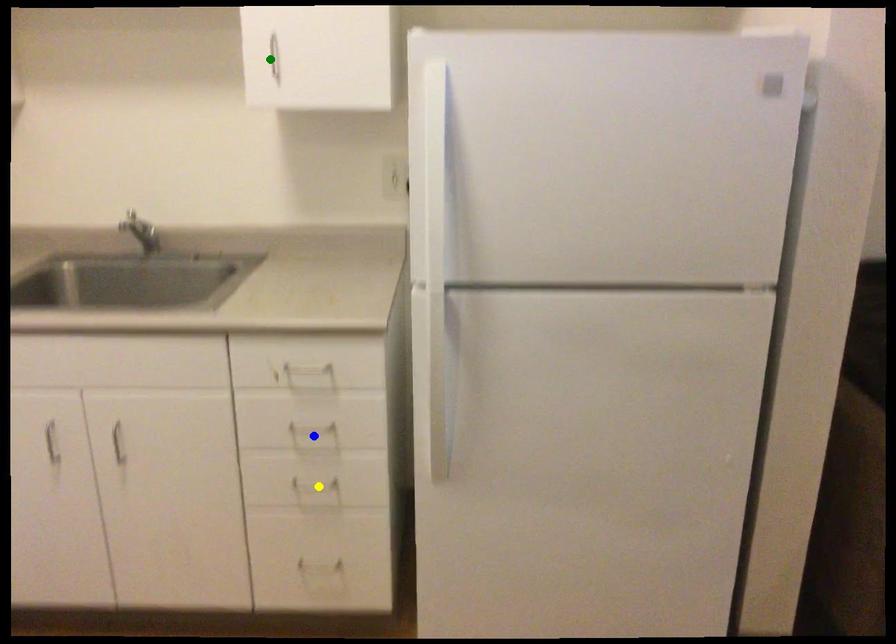
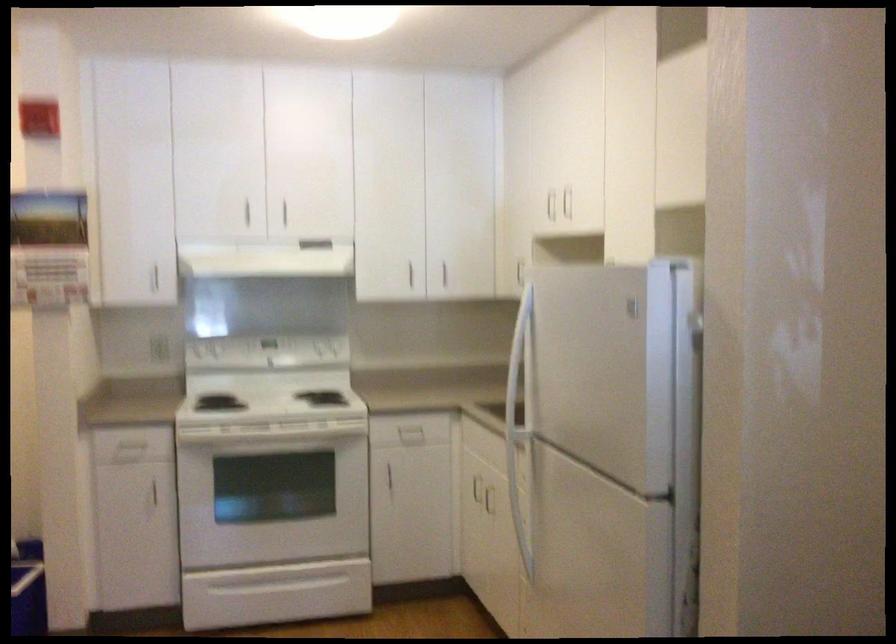
I am providing you with two images of the same scene from different viewpoints. Three points are marked in image1. Which point corresponds to a part or object that is occluded in image2?In image1, three points are marked. Which of them correspond to a part or object that is occluded in image2?Among the three points shown in image1, which one corresponds to a part or object that is no longer visible due to occlusion in image2?

blue point, yellow point, green point